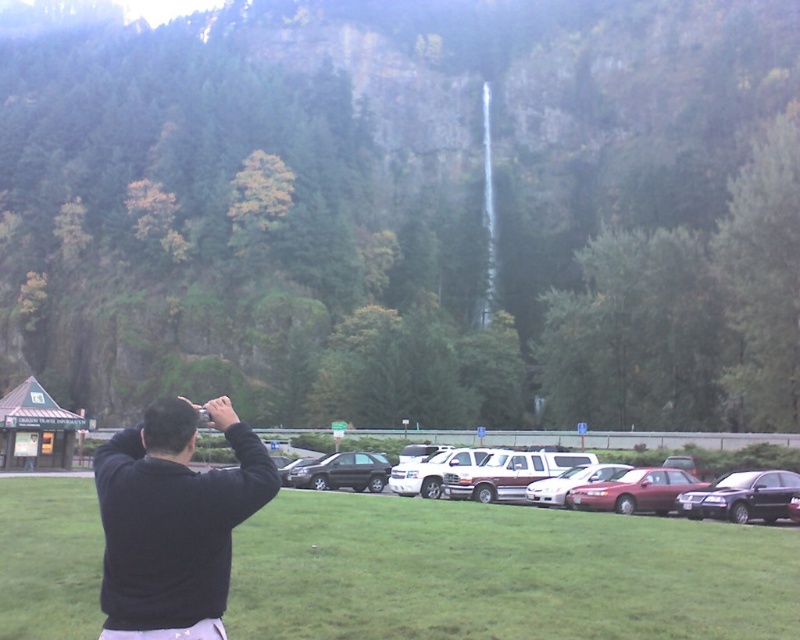
Is shiny black sedan at lower right shorter than metallic silver suv at center?

Correct, shiny black sedan at lower right is not as tall as metallic silver suv at center.

Is point (768, 506) in front of point (716, 481)?

Yes, it is in front of point (716, 481).

Is point (741, 496) positioned before point (758, 515)?

That is False.

Where is `shiny black sedan at lower right`? This screenshot has width=800, height=640. shiny black sedan at lower right is located at coordinates (741, 497).

Can you confirm if shiny black sedan at lower right is taller than shiny silver sedan at center?

No, shiny black sedan at lower right is not taller than shiny silver sedan at center.

Who is taller, shiny black sedan at lower right or shiny silver sedan at center?

shiny silver sedan at center

You are a GUI agent. You are given a task and a screenshot of the screen. Output one action in this format:
    pyautogui.click(x=<x>, y=<y>)
    Task: Click on the shiny black sedan at lower right
    This screenshot has height=640, width=800.
    Given the screenshot: What is the action you would take?
    pyautogui.click(x=741, y=497)

Locate an element on the screen. The width and height of the screenshot is (800, 640). shiny black sedan at lower right is located at coordinates (741, 497).

Is black matte jacket at center above metallic silver suv at center?

Yes, black matte jacket at center is above metallic silver suv at center.

Between point (162, 404) and point (636, 461), which one is positioned in front?

Point (162, 404) is more forward.

You are a GUI agent. You are given a task and a screenshot of the screen. Output one action in this format:
    pyautogui.click(x=<x>, y=<y>)
    Task: Click on the black matte jacket at center
    The width and height of the screenshot is (800, 640).
    Given the screenshot: What is the action you would take?
    [x=173, y=522]